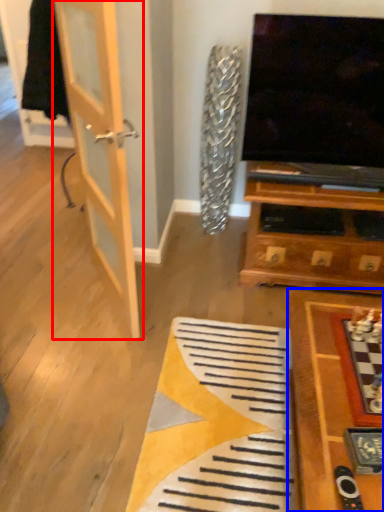
Question: Which of the following is the farthest to the observer, door (highlighted by a red box) or table (highlighted by a blue box)?

Choices:
 (A) door
 (B) table

Answer: (A)